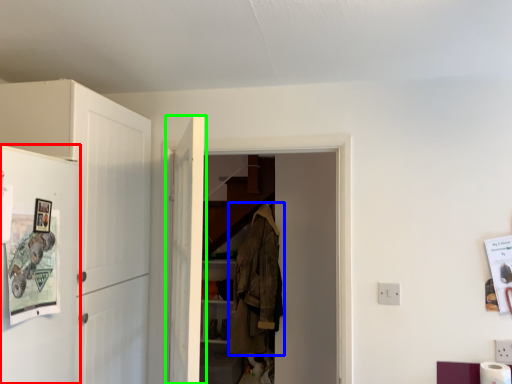
Question: Based on their relative distances, which object is nearer to fridge (highlighted by a red box)? Choose from clothing (highlighted by a blue box) and door (highlighted by a green box).

Choices:
 (A) clothing
 (B) door

Answer: (B)